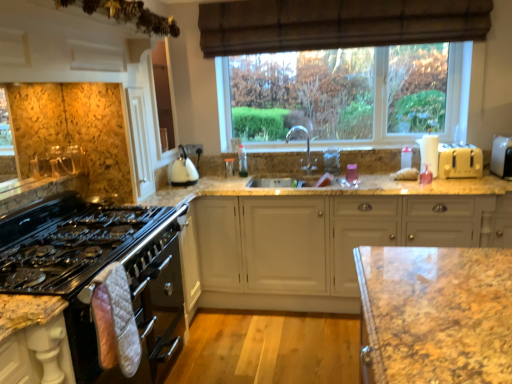
Question: Considering the relative sizes of silver metallic faucet at center and white plastic toaster at right, the first appliance viewed from the left, in the image provided, is silver metallic faucet at center smaller than white plastic toaster at right, the first appliance viewed from the left,?

Choices:
 (A) no
 (B) yes

Answer: (A)

Question: Does silver metallic faucet at center have a greater height compared to white plastic toaster at right, the first appliance viewed from the left?

Choices:
 (A) no
 (B) yes

Answer: (B)

Question: Is silver metallic faucet at center shorter than white plastic toaster at right, the first appliance viewed from the left?

Choices:
 (A) no
 (B) yes

Answer: (A)

Question: Considering the relative positions of silver metallic faucet at center and white plastic toaster at right, the first appliance viewed from the left, in the image provided, is silver metallic faucet at center to the right of white plastic toaster at right, the first appliance viewed from the left, from the viewer's perspective?

Choices:
 (A) yes
 (B) no

Answer: (B)

Question: Considering the relative sizes of silver metallic faucet at center and white plastic toaster at right, the first appliance viewed from the left, in the image provided, is silver metallic faucet at center bigger than white plastic toaster at right, the first appliance viewed from the left,?

Choices:
 (A) yes
 (B) no

Answer: (A)

Question: From a real-world perspective, is silver metallic faucet at center located beneath white plastic toaster at right, which is the second appliance from right to left?

Choices:
 (A) yes
 (B) no

Answer: (B)

Question: Does white plastic toaster at right, positioned as the first appliance in right-to-left order, appear on the right side of white matte cabinet at center?

Choices:
 (A) yes
 (B) no

Answer: (A)

Question: Can you confirm if white plastic toaster at right, positioned as the first appliance in right-to-left order, is taller than white matte cabinet at center?

Choices:
 (A) yes
 (B) no

Answer: (B)

Question: Does white plastic toaster at right, positioned as the first appliance in right-to-left order, turn towards white matte cabinet at center?

Choices:
 (A) yes
 (B) no

Answer: (B)

Question: Can you confirm if white plastic toaster at right, positioned as the first appliance in right-to-left order, is smaller than white matte cabinet at center?

Choices:
 (A) yes
 (B) no

Answer: (A)

Question: From a real-world perspective, is white plastic toaster at right, which is the 2th appliance in left-to-right order, located higher than white matte cabinet at center?

Choices:
 (A) yes
 (B) no

Answer: (A)

Question: From the image's perspective, is white plastic toaster at right, which is the 2th appliance in left-to-right order, below white matte cabinet at center?

Choices:
 (A) yes
 (B) no

Answer: (B)

Question: From the image's perspective, is black glass gas stove at left below white plastic toaster at right, the first appliance viewed from the left?

Choices:
 (A) yes
 (B) no

Answer: (A)